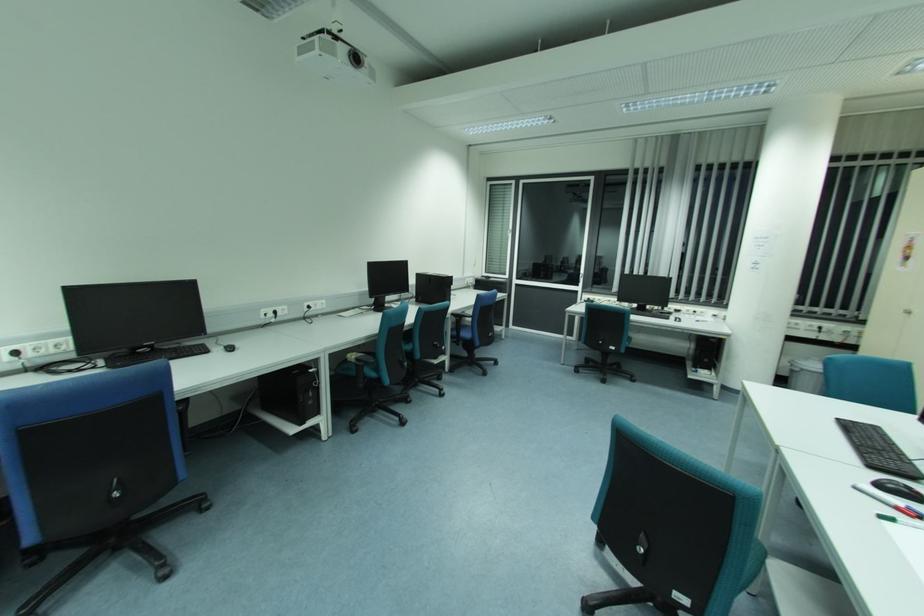
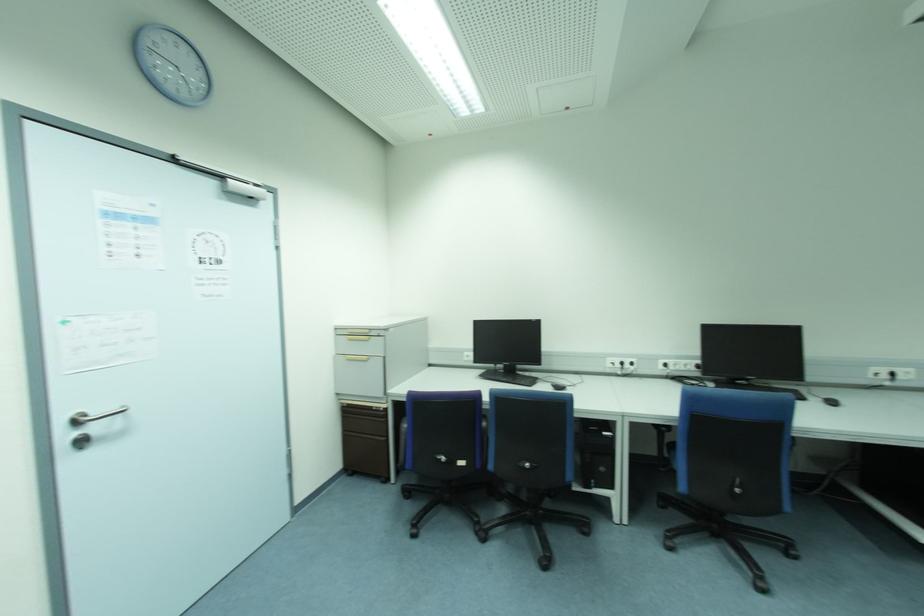
Question: The camera is either moving clockwise (left) or counter-clockwise (right) around the object. The first image is from the beginning of the video and the second image is from the end. Is the camera moving left or right when shooting the video?

Choices:
 (A) Left
 (B) Right

Answer: (B)